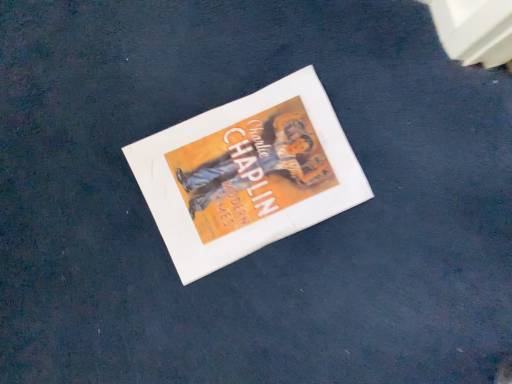
Locate an element on the screen. free space above matte paper poster at center (from a real-world perspective) is located at coordinates (242, 173).